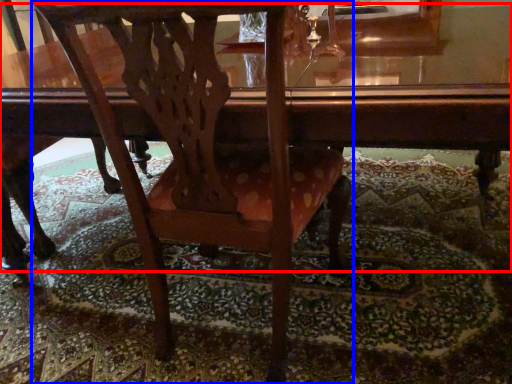
Question: Which of the following is the closest to the observer, table (highlighted by a red box) or chair (highlighted by a blue box)?

Choices:
 (A) table
 (B) chair

Answer: (A)